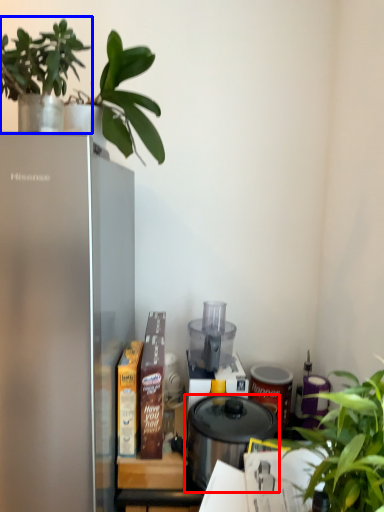
Question: Which object appears farthest to the camera in this image, pressure cooker (highlighted by a red box) or houseplant (highlighted by a blue box)?

Choices:
 (A) pressure cooker
 (B) houseplant

Answer: (A)